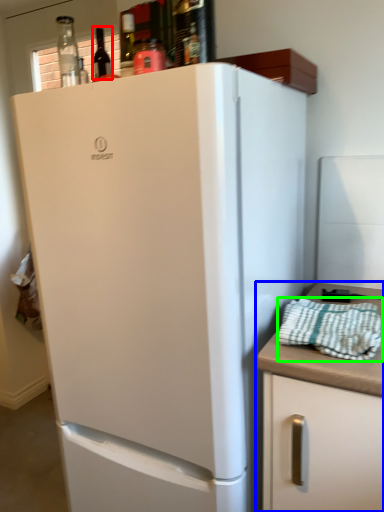
Question: Based on their relative distances, which object is farther from wine bottle (highlighted by a red box)? Choose from cabinetry (highlighted by a blue box) and blanket (highlighted by a green box).

Choices:
 (A) cabinetry
 (B) blanket

Answer: (A)